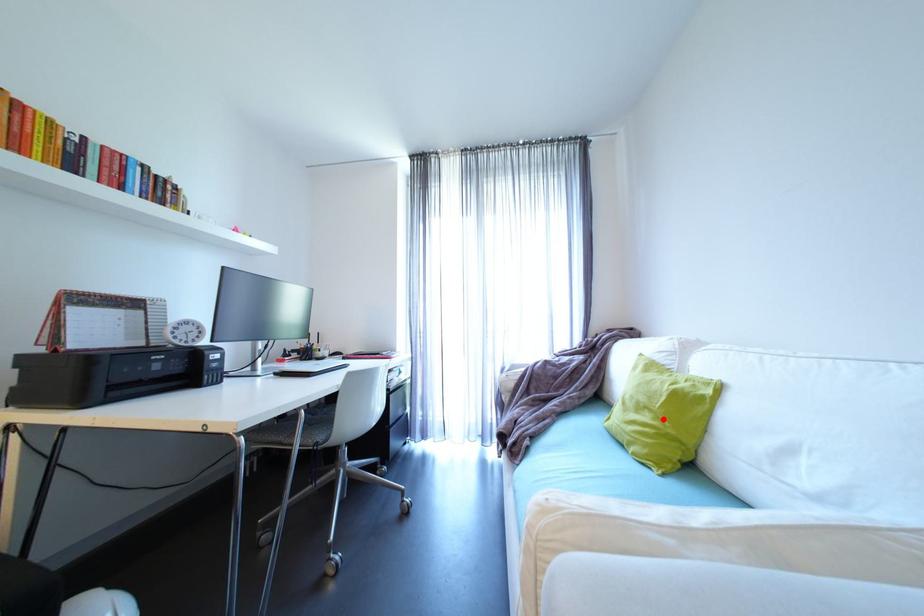
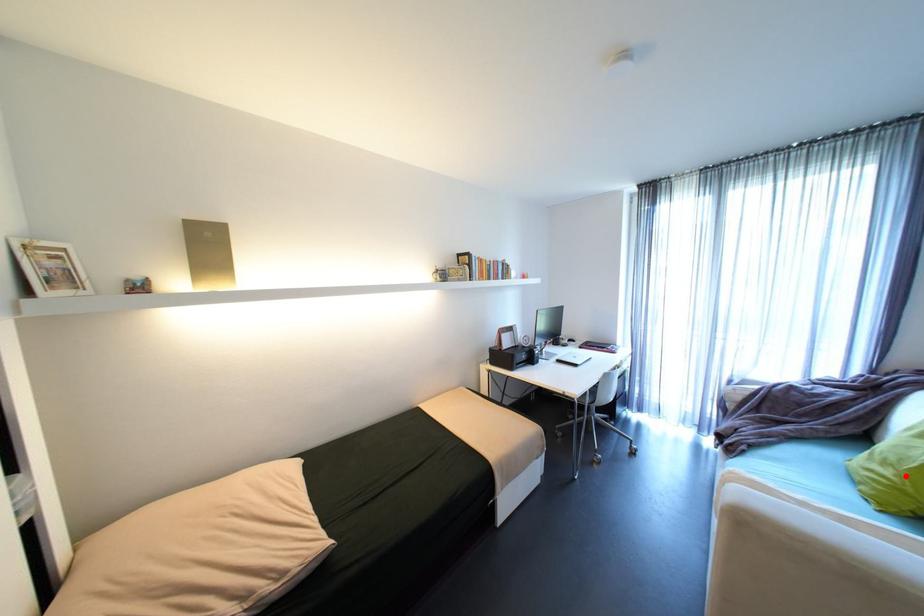
I am providing you with two images of the same scene from different viewpoints. A red point is marked on the first image and another point is marked on the second image. Is the red point in image1 aligned with the point shown in image2?

Yes